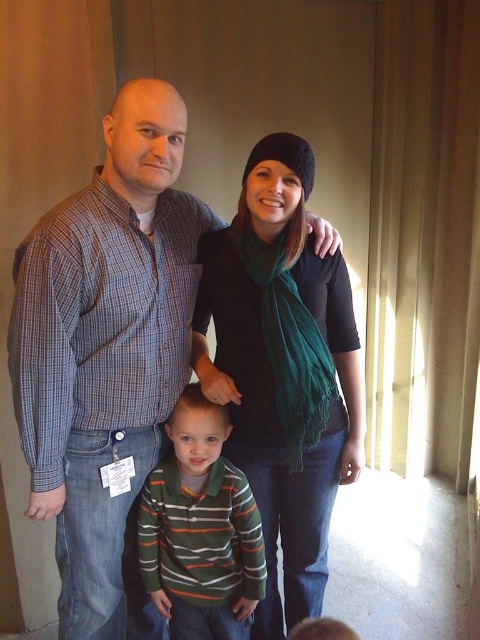
Based on the photo, between plaid shirt at center and black soft scarf at center, which one appears on the right side from the viewer's perspective?

From the viewer's perspective, black soft scarf at center appears more on the right side.

Is point (141, 353) more distant than point (280, 150)?

Yes, it is.

This screenshot has height=640, width=480. I want to click on plaid shirt at center, so click(106, 353).

Who is higher up, black soft scarf at center or striped cotton shirt at center?

black soft scarf at center is above.

Who is more distant from viewer, (194, 371) or (166, 467)?

The point (194, 371) is more distant.

Where is `black soft scarf at center`? The height and width of the screenshot is (640, 480). black soft scarf at center is located at coordinates (283, 371).

Does plaid shirt at center have a lesser width compared to striped cotton shirt at center?

In fact, plaid shirt at center might be wider than striped cotton shirt at center.

Image resolution: width=480 pixels, height=640 pixels. Describe the element at coordinates (106, 353) in the screenshot. I see `plaid shirt at center` at that location.

You are a GUI agent. You are given a task and a screenshot of the screen. Output one action in this format:
    pyautogui.click(x=<x>, y=<y>)
    Task: Click on the plaid shirt at center
    This screenshot has width=480, height=640.
    Given the screenshot: What is the action you would take?
    pyautogui.click(x=106, y=353)